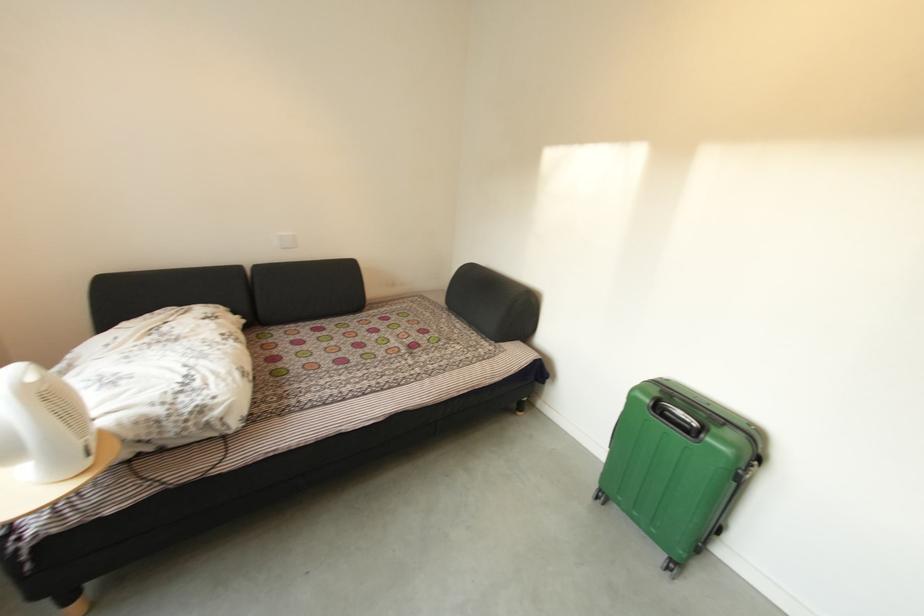
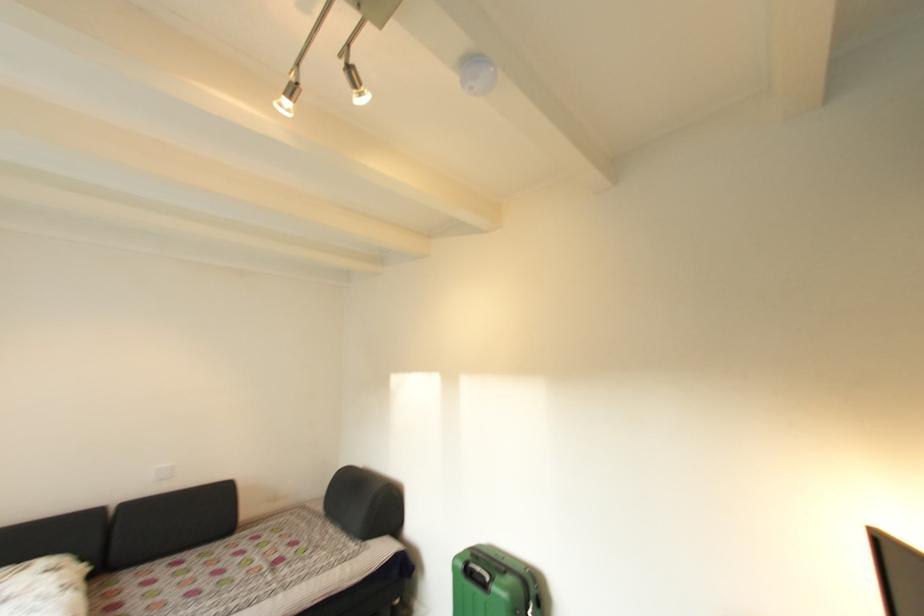
Locate, in the second image, the point that corresponds to point 465,321 in the first image.

(341, 525)